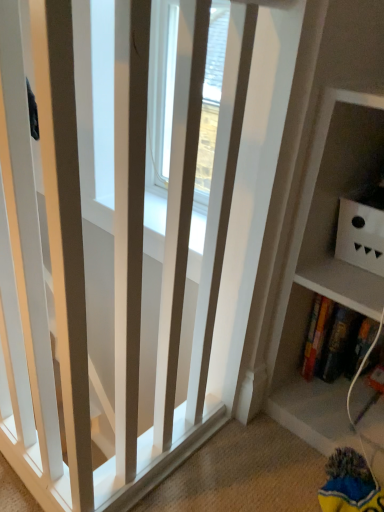
Question: Can you confirm if white matte box at upper right is wider than hardcover book at lower right?

Choices:
 (A) yes
 (B) no

Answer: (A)

Question: From a real-world perspective, is white matte box at upper right located higher than hardcover book at lower right?

Choices:
 (A) yes
 (B) no

Answer: (A)

Question: Does white matte box at upper right have a smaller size compared to hardcover book at lower right?

Choices:
 (A) no
 (B) yes

Answer: (A)

Question: Would you say white matte box at upper right is a long distance from hardcover book at lower right?

Choices:
 (A) yes
 (B) no

Answer: (B)

Question: Is white matte box at upper right completely or partially outside of hardcover book at lower right?

Choices:
 (A) yes
 (B) no

Answer: (A)

Question: Could you tell me if white matte box at upper right is facing hardcover book at lower right?

Choices:
 (A) yes
 (B) no

Answer: (B)

Question: Are hardcover book at lower right and white matte box at upper right located far from each other?

Choices:
 (A) no
 (B) yes

Answer: (A)

Question: From the image's perspective, is hardcover book at lower right below white matte box at upper right?

Choices:
 (A) no
 (B) yes

Answer: (B)

Question: Does hardcover book at lower right come behind white matte box at upper right?

Choices:
 (A) yes
 (B) no

Answer: (A)

Question: Can you confirm if hardcover book at lower right is positioned to the right of white matte box at upper right?

Choices:
 (A) yes
 (B) no

Answer: (B)

Question: Is the position of hardcover book at lower right less distant than that of white matte box at upper right?

Choices:
 (A) no
 (B) yes

Answer: (A)

Question: Is hardcover book at lower right wider than white matte box at upper right?

Choices:
 (A) no
 (B) yes

Answer: (A)

Question: Would you say hardcover book at lower right is to the left or to the right of white matte box at upper right in the picture?

Choices:
 (A) left
 (B) right

Answer: (A)